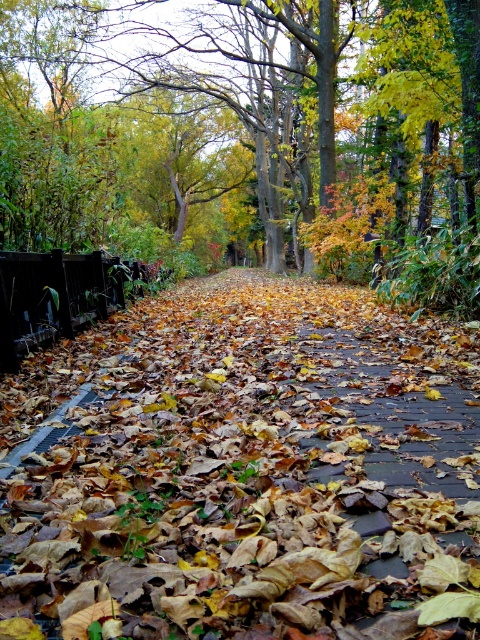
Question: Where is brown stone pavement at center located in relation to green leafy tree at center in the image?

Choices:
 (A) left
 (B) right

Answer: (B)

Question: Does brown stone pavement at center have a greater width compared to green leafy tree at center?

Choices:
 (A) no
 (B) yes

Answer: (A)

Question: Does brown stone pavement at center appear under green leafy tree at center?

Choices:
 (A) yes
 (B) no

Answer: (A)

Question: Among these points, which one is farthest from the camera?

Choices:
 (A) (51, 634)
 (B) (382, 109)

Answer: (B)

Question: Which point appears farthest from the camera in this image?

Choices:
 (A) (305, 408)
 (B) (285, 83)

Answer: (B)

Question: Which object appears farthest from the camera in this image?

Choices:
 (A) brown stone pavement at center
 (B) green leafy tree at center

Answer: (B)